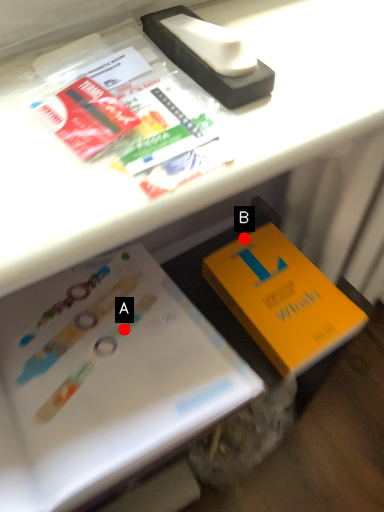
Question: Two points are circled on the image, labeled by A and B beside each circle. Which point is farther from the camera taking this photo?

Choices:
 (A) A is further
 (B) B is further

Answer: (B)